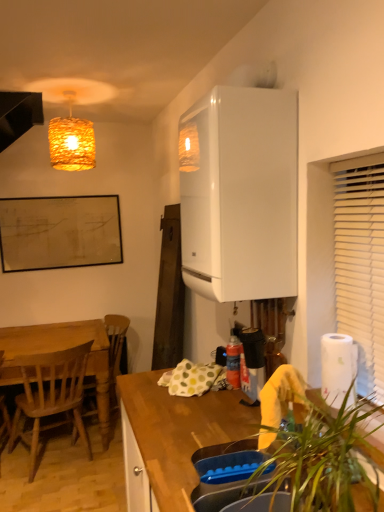
Image resolution: width=384 pixels, height=512 pixels. In order to click on blank space above wooden at lower right (from a real-world perspective) in this screenshot , I will do `click(199, 417)`.